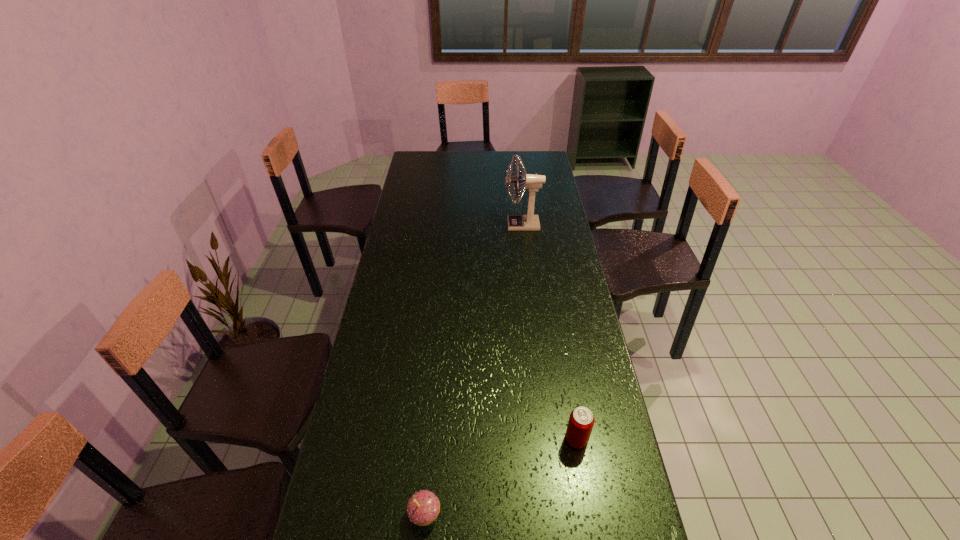
Where is `fan that is positioned at the right edge`? The width and height of the screenshot is (960, 540). fan that is positioned at the right edge is located at coordinates (530, 222).

You are a GUI agent. You are given a task and a screenshot of the screen. Output one action in this format:
    pyautogui.click(x=<x>, y=<y>)
    Task: Click on the can at the right edge
    The width and height of the screenshot is (960, 540).
    Given the screenshot: What is the action you would take?
    pyautogui.click(x=581, y=421)

The height and width of the screenshot is (540, 960). In the image, there is a desktop. Identify the location of vacant area at the left edge. (375, 507).

Image resolution: width=960 pixels, height=540 pixels. Identify the location of vacant space at the right edge. (566, 333).

You are a GUI agent. You are given a task and a screenshot of the screen. Output one action in this format:
    pyautogui.click(x=<x>, y=<y>)
    Task: Click on the free space at the far left corner
    
    Given the screenshot: What is the action you would take?
    pyautogui.click(x=435, y=156)

Where is `vacant space at the far right corner of the desktop`? The height and width of the screenshot is (540, 960). vacant space at the far right corner of the desktop is located at coordinates (536, 161).

You are a GUI agent. You are given a task and a screenshot of the screen. Output one action in this format:
    pyautogui.click(x=<x>, y=<y>)
    Task: Click on the vacant point located between the fan and the cupcake
    The width and height of the screenshot is (960, 540).
    Given the screenshot: What is the action you would take?
    pyautogui.click(x=473, y=369)

In order to click on free space between the fan and the leftmost object in this screenshot , I will do pyautogui.click(x=473, y=369).

Find the location of a particular element. free spot between the second nearest object and the farthest object is located at coordinates (549, 332).

Locate an element on the screen. free area in between the nearest object and the second farthest object is located at coordinates (500, 477).